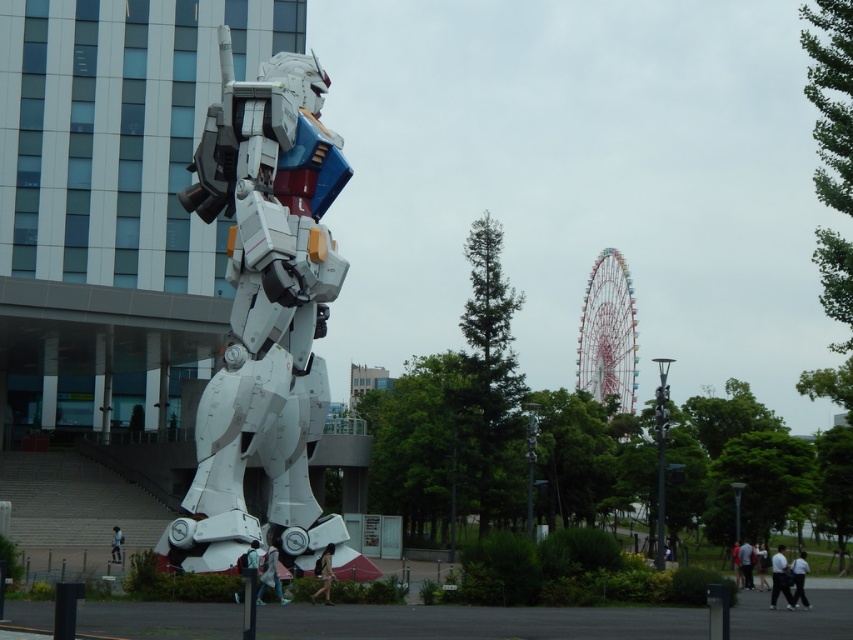
Looking at this image, you are a photographer standing in front of the robot statue. You notice a light brown leather jacket at lower center and a light blue shirt at lower right in your view. Which clothing item is closer to the left side of your camera frame?

The light brown leather jacket at lower center is positioned on the left side of the light blue shirt at lower right, so it is closer to the left side of the camera frame.

You are a photographer at the scene and want to capture both the light blue shirt at lower right and the white matte shirt at lower right in a single frame. Which shirt should you focus on first to ensure both are in the frame?

The light blue shirt at lower right has a smaller size compared to the white matte shirt at lower right, so you should focus on the white matte shirt at lower right first to ensure both are in the frame.

You are standing at the entrance of the modern building and want to take a photo of the white metallic robot at center. Which direction should you face to capture it in your shot?

You should face towards the direction where the white metallic robot at center is located, which is at point coordinates of (264, 310). Since the robot is positioned in front of the modern building, facing outward from the building entrance towards the robot should allow you to capture it in your photo.